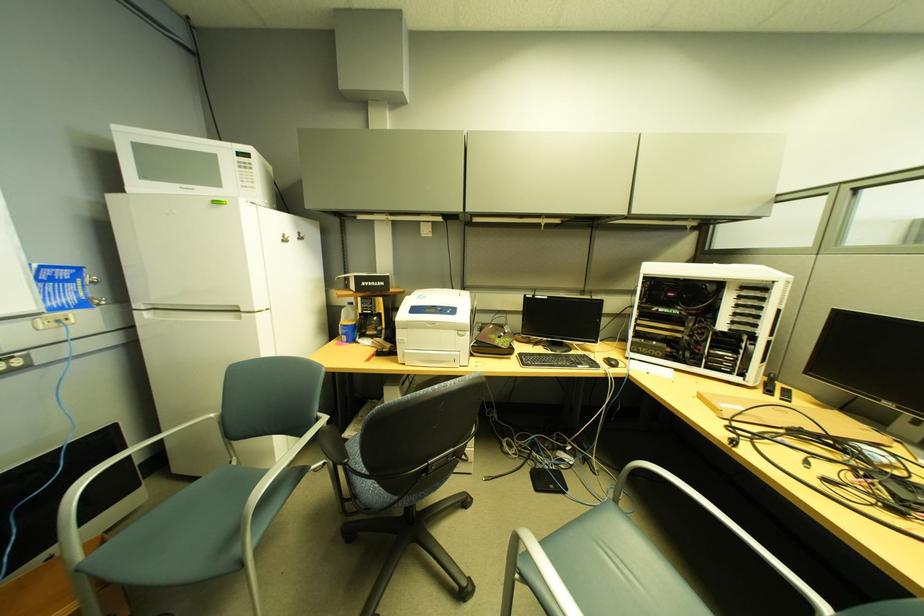
You are a GUI agent. You are given a task and a screenshot of the screen. Output one action in this format:
    pyautogui.click(x=<x>, y=<y>)
    Task: Click on the refrigerator door handle
    The width and height of the screenshot is (924, 616).
    Given the screenshot: What is the action you would take?
    tap(193, 310)